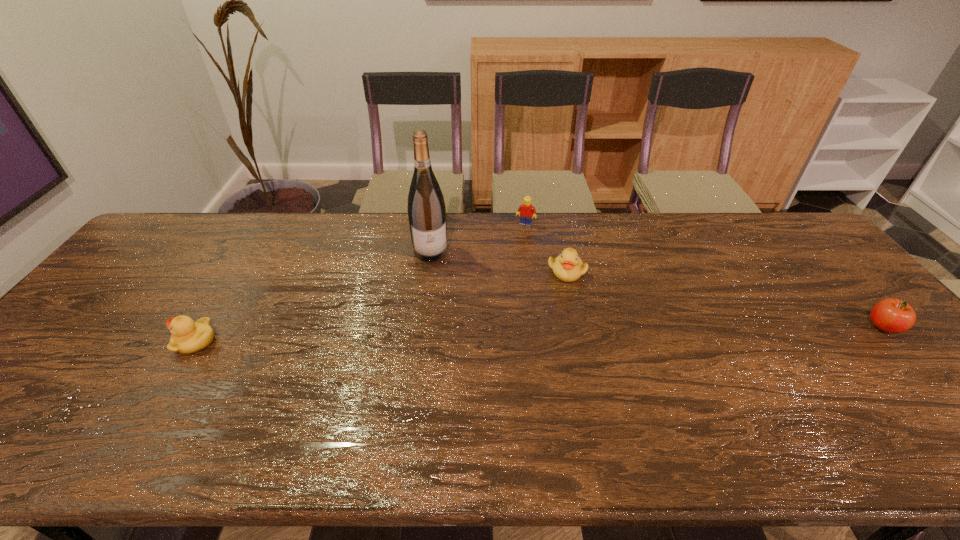
This screenshot has width=960, height=540. What are the coordinates of `vacant space located on the front-facing side of the farthest object` in the screenshot? It's located at (519, 238).

Where is `vacant position located on the front-facing side of the farthest object`? vacant position located on the front-facing side of the farthest object is located at coordinates (493, 308).

The width and height of the screenshot is (960, 540). Identify the location of wine bottle present at the far edge. (426, 207).

The width and height of the screenshot is (960, 540). Identify the location of Lego that is at the far edge. (525, 211).

Locate an element on the screen. object at the right edge is located at coordinates (890, 315).

Find the location of `free space at the far edge of the desktop`. free space at the far edge of the desktop is located at coordinates (456, 251).

In the image, there is a desktop. Where is `free space at the near edge`? The image size is (960, 540). free space at the near edge is located at coordinates (783, 398).

Find the location of a particular element. Image resolution: width=960 pixels, height=540 pixels. blank area at the left edge is located at coordinates (138, 256).

You are a GUI agent. You are given a task and a screenshot of the screen. Output one action in this format:
    pyautogui.click(x=<x>, y=<y>)
    Task: Click on the vacant region at the right edge
    
    Given the screenshot: What is the action you would take?
    click(x=829, y=318)

In the image, there is a desktop. At what (x,y) coordinates should I click in order to perform the action: click on vacant space at the far left corner. Please return your answer as a coordinate pair (x, y). The image size is (960, 540). Looking at the image, I should click on (180, 242).